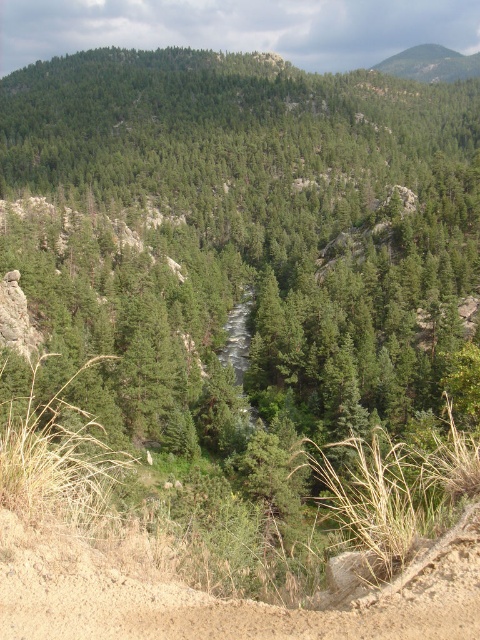
Question: In this image, where is brown sandy dirt track at lower left located relative to green textured rock at upper right?

Choices:
 (A) below
 (B) above

Answer: (A)

Question: Which point is farther to the camera?

Choices:
 (A) green textured rock at upper right
 (B) brown sandy dirt track at lower left

Answer: (A)

Question: Is the position of brown sandy dirt track at lower left less distant than that of green textured rock at upper right?

Choices:
 (A) no
 (B) yes

Answer: (B)

Question: Which of the following is the closest to the observer?

Choices:
 (A) green textured rock at upper right
 (B) brown sandy dirt track at lower left

Answer: (B)

Question: Is brown sandy dirt track at lower left bigger than green textured rock at upper right?

Choices:
 (A) no
 (B) yes

Answer: (A)